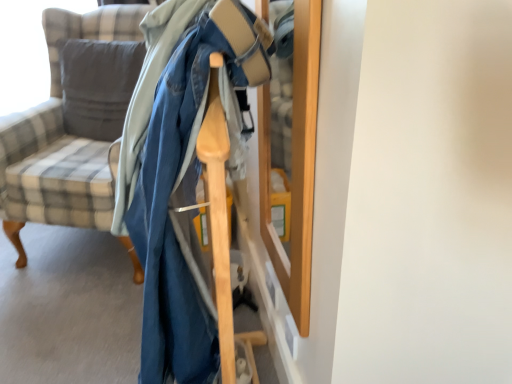
The width and height of the screenshot is (512, 384). Describe the element at coordinates (98, 85) in the screenshot. I see `soft gray cushion at left` at that location.

Locate an element on the screen. Image resolution: width=512 pixels, height=384 pixels. soft gray cushion at left is located at coordinates (98, 85).

The height and width of the screenshot is (384, 512). I want to click on plaid fabric chair at left, so click(x=72, y=124).

The image size is (512, 384). What do you see at coordinates (72, 124) in the screenshot? I see `plaid fabric chair at left` at bounding box center [72, 124].

The height and width of the screenshot is (384, 512). I want to click on soft gray cushion at left, so click(98, 85).

Is soft gray cushion at left at the right side of plaid fabric chair at left?

No.

Which is in front, soft gray cushion at left or plaid fabric chair at left?

plaid fabric chair at left is more forward.

Considering the positions of points (67, 48) and (143, 56), is point (67, 48) closer to camera compared to point (143, 56)?

No.

From the image's perspective, who appears lower, soft gray cushion at left or plaid fabric chair at left?

plaid fabric chair at left appears lower in the image.

From a real-world perspective, which is physically above, soft gray cushion at left or plaid fabric chair at left?

soft gray cushion at left is physically above.

Between soft gray cushion at left and plaid fabric chair at left, which one has larger width?

With larger width is plaid fabric chair at left.

Who is taller, soft gray cushion at left or plaid fabric chair at left?

plaid fabric chair at left is taller.

Considering the sizes of objects soft gray cushion at left and plaid fabric chair at left in the image provided, who is bigger, soft gray cushion at left or plaid fabric chair at left?

plaid fabric chair at left.

Is soft gray cushion at left situated inside plaid fabric chair at left or outside?

soft gray cushion at left is inside plaid fabric chair at left.

From the picture: Is soft gray cushion at left far from plaid fabric chair at left?

No, soft gray cushion at left is in close proximity to plaid fabric chair at left.

Could you tell me if soft gray cushion at left is turned towards plaid fabric chair at left?

Yes, soft gray cushion at left is turned towards plaid fabric chair at left.

Can you tell me how much soft gray cushion at left and plaid fabric chair at left differ in facing direction?

soft gray cushion at left and plaid fabric chair at left are facing 4.85 degrees away from each other.

You are a GUI agent. You are given a task and a screenshot of the screen. Output one action in this format:
    pyautogui.click(x=<x>, y=<y>)
    Task: Click on the pillow behind the plaid fabric chair at left
    This screenshot has width=512, height=384.
    Given the screenshot: What is the action you would take?
    pyautogui.click(x=98, y=85)

Looking at this image, does plaid fabric chair at left appear on the left side of soft gray cushion at left?

No.

Is the position of plaid fabric chair at left less distant than that of soft gray cushion at left?

Yes, it is.

Which point is more forward, (78,93) or (139,50)?

The point (139,50) is more forward.

From the image's perspective, relative to soft gray cushion at left, is plaid fabric chair at left above or below?

plaid fabric chair at left is situated lower than soft gray cushion at left in the image.

From a real-world perspective, which is physically above, plaid fabric chair at left or soft gray cushion at left?

soft gray cushion at left is physically above.

Does plaid fabric chair at left have a lesser width compared to soft gray cushion at left?

Incorrect, the width of plaid fabric chair at left is not less than that of soft gray cushion at left.

Can you confirm if plaid fabric chair at left is shorter than soft gray cushion at left?

No, plaid fabric chair at left is not shorter than soft gray cushion at left.

Which of these two, plaid fabric chair at left or soft gray cushion at left, is bigger?

plaid fabric chair at left.

Based on the photo, is plaid fabric chair at left situated inside soft gray cushion at left or outside?

plaid fabric chair at left is outside soft gray cushion at left.

Is plaid fabric chair at left next to soft gray cushion at left?

Absolutely, plaid fabric chair at left is next to and touching soft gray cushion at left.

Is plaid fabric chair at left oriented towards soft gray cushion at left?

Yes, plaid fabric chair at left faces towards soft gray cushion at left.

What's the angular difference between plaid fabric chair at left and soft gray cushion at left's facing directions?

They differ by 4.85 degrees in their facing directions.

You are a GUI agent. You are given a task and a screenshot of the screen. Output one action in this format:
    pyautogui.click(x=<x>, y=<y>)
    Task: Click on the chair lying below the soft gray cushion at left (from the image's perspective)
    This screenshot has width=512, height=384.
    Given the screenshot: What is the action you would take?
    pyautogui.click(x=72, y=124)

At what (x,y) coordinates should I click in order to perform the action: click on pillow located above the plaid fabric chair at left (from the image's perspective). Please return your answer as a coordinate pair (x, y). This screenshot has height=384, width=512. Looking at the image, I should click on (98, 85).

Image resolution: width=512 pixels, height=384 pixels. What are the coordinates of `chair on the right of soft gray cushion at left` in the screenshot? It's located at (72, 124).